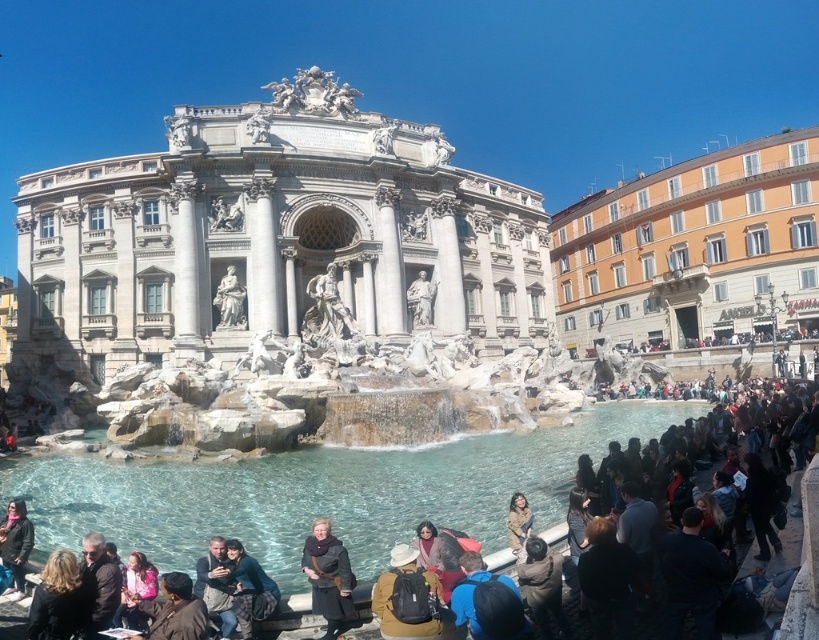
You are standing in front of the Trevi Fountain and want to take a photo. You notice two points marked in the image. The first point is at coordinate point(71, 605) and the second is at point(143, 586). Which point is closer to you?

Point(71, 605) is closer to the viewer than point(143, 586).

You are a photographer planning to capture a photo of the Trevi Fountain with both the dark blue fabric jacket at lower center and the brown leather jacket at lower center in the frame. Which jacket should you focus on to ensure it appears bigger in the photo?

The dark blue fabric jacket at lower center has a larger size compared to the brown leather jacket at lower center, so focusing on it will ensure it appears bigger in the photo.